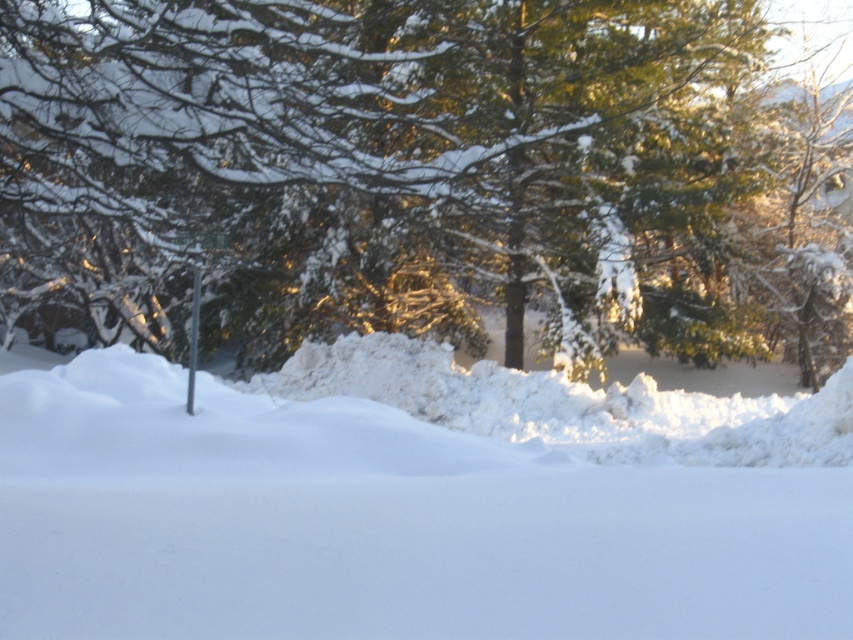
Is point (183, 163) less distant than point (189, 390)?

No.

Locate an element on the screen. green textured pine tree at center is located at coordinates (432, 172).

Where is `green textured pine tree at center`? green textured pine tree at center is located at coordinates (432, 172).

Is white fluffy snow at center behind metallic pole at center?

No, it is not.

Identify the location of white fluffy snow at center. The image size is (853, 640). (380, 524).

Can you confirm if green textured pine tree at center is thinner than white fluffy snow at center?

Incorrect, green textured pine tree at center's width is not less than white fluffy snow at center's.

In the scene shown: Does green textured pine tree at center appear over white fluffy snow at center?

Indeed, green textured pine tree at center is positioned over white fluffy snow at center.

Between point (666, 284) and point (634, 506), which one is positioned behind?

Point (666, 284)

At what (x,y) coordinates should I click in order to perform the action: click on green textured pine tree at center. Please return your answer as a coordinate pair (x, y). The image size is (853, 640). Looking at the image, I should click on pos(432,172).